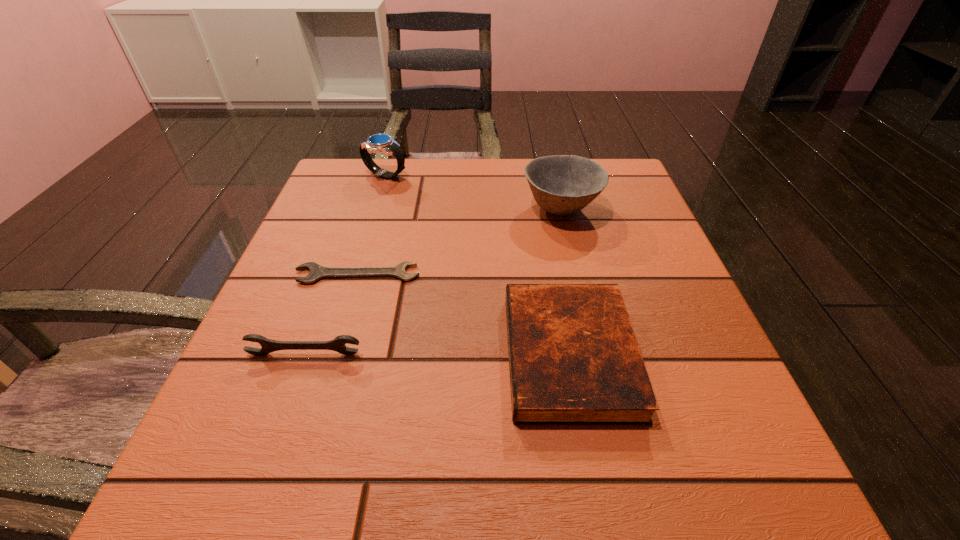
In order to click on vacant space at the far edge of the desktop in this screenshot , I will do `click(526, 190)`.

Identify the location of vacant space at the near edge. coord(368,500).

Find the location of a particular element. The image size is (960, 540). free region at the left edge of the desktop is located at coordinates (285, 268).

In the image, there is a desktop. Where is `free space at the right edge`? Image resolution: width=960 pixels, height=540 pixels. free space at the right edge is located at coordinates (619, 276).

Where is `free space at the far left corner`? free space at the far left corner is located at coordinates (383, 167).

I want to click on vacant point at the near left corner, so [x=208, y=504].

Locate an element on the screen. The height and width of the screenshot is (540, 960). vacant space at the far right corner of the desktop is located at coordinates (603, 193).

You are a GUI agent. You are given a task and a screenshot of the screen. Output one action in this format:
    pyautogui.click(x=<x>, y=<y>)
    Task: Click on the vacant point located between the watch and the third farthest object
    The width and height of the screenshot is (960, 540).
    Given the screenshot: What is the action you would take?
    pyautogui.click(x=372, y=225)

Find the location of a particular element. This screenshot has height=540, width=960. free point between the farthest object and the Bible is located at coordinates (477, 265).

This screenshot has height=540, width=960. Find the location of `empty space that is in between the Bible and the third farthest object`. empty space that is in between the Bible and the third farthest object is located at coordinates (464, 315).